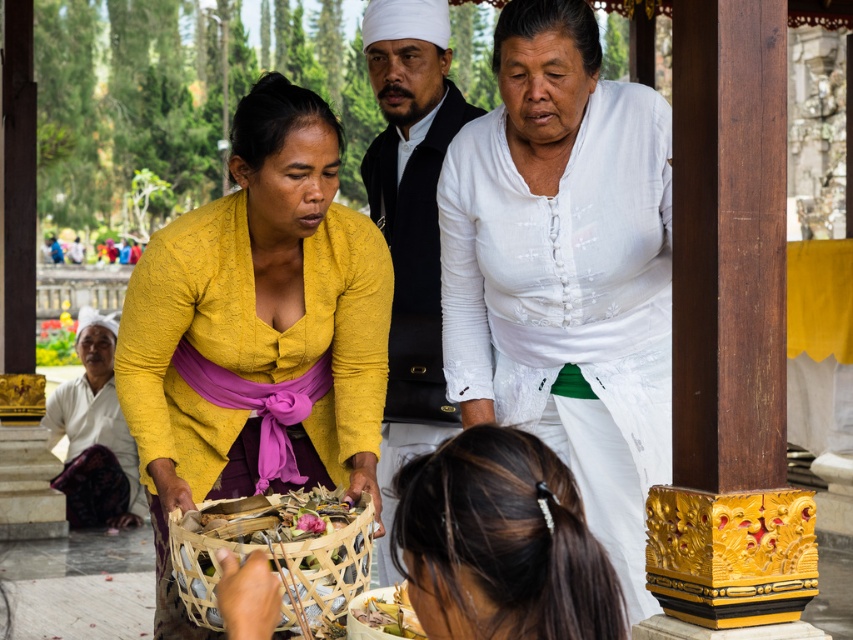
Question: Among these objects, which one is farthest from the camera?

Choices:
 (A) matte yellow blouse at center
 (B) matte black jacket at center
 (C) white sheer blouse at center

Answer: (B)

Question: Does white sheer blouse at center have a greater width compared to brown hair at lower center?

Choices:
 (A) no
 (B) yes

Answer: (B)

Question: Is matte yellow blouse at center below white sheer blouse at center?

Choices:
 (A) yes
 (B) no

Answer: (A)

Question: Observing the image, what is the correct spatial positioning of matte black jacket at center in reference to purple silk robe at lower left?

Choices:
 (A) above
 (B) below

Answer: (A)

Question: Which of the following is the farthest from the observer?

Choices:
 (A) purple silk robe at lower left
 (B) white sheer blouse at center

Answer: (A)

Question: Among these objects, which one is nearest to the camera?

Choices:
 (A) purple silk robe at lower left
 (B) matte yellow blouse at center

Answer: (B)